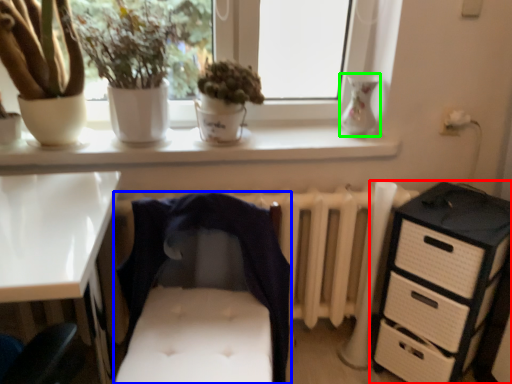
Question: Which object is positioned closest to chest of drawers (highlighted by a red box)? Select from infant bed (highlighted by a blue box) and vase (highlighted by a green box).

Choices:
 (A) infant bed
 (B) vase

Answer: (A)